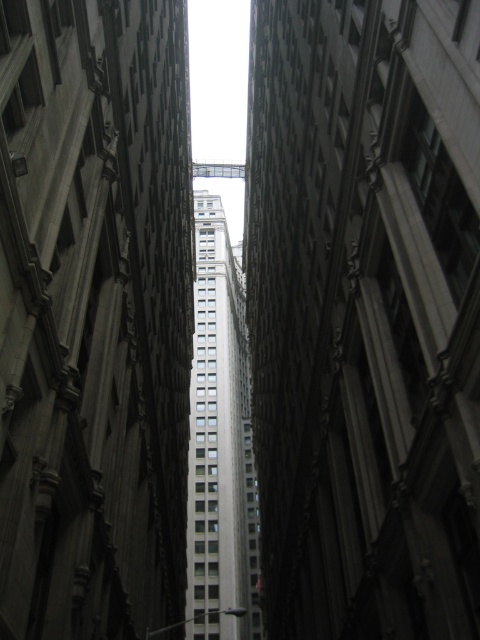
Question: Which point is farther to the camera?

Choices:
 (A) smooth concrete building at center
 (B) gray concrete skyscraper at center

Answer: (A)

Question: Among these objects, which one is nearest to the camera?

Choices:
 (A) gray concrete skyscraper at center
 (B) smooth concrete building at center
 (C) white marble skyscraper at center

Answer: (A)

Question: Is gray concrete skyscraper at center above white marble skyscraper at center?

Choices:
 (A) no
 (B) yes

Answer: (B)

Question: Does smooth concrete building at center appear on the right side of white marble skyscraper at center?

Choices:
 (A) yes
 (B) no

Answer: (A)

Question: Among these objects, which one is farthest from the camera?

Choices:
 (A) gray concrete skyscraper at center
 (B) white marble skyscraper at center

Answer: (B)

Question: Does gray concrete skyscraper at center have a greater width compared to white marble skyscraper at center?

Choices:
 (A) yes
 (B) no

Answer: (B)